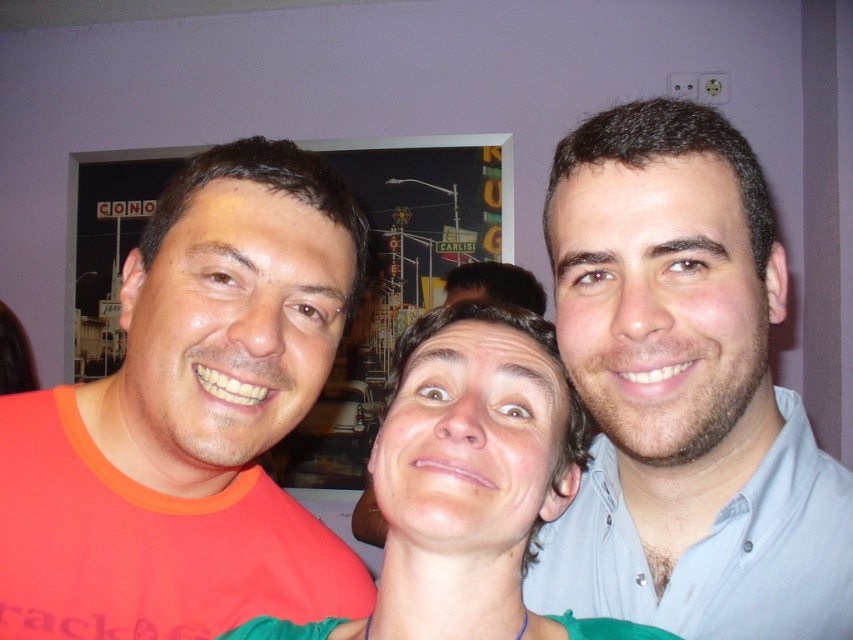
Does orange cotton t-shirt at left appear under light blue shirt at right?

Correct, orange cotton t-shirt at left is located below light blue shirt at right.

Is point (225, 237) less distant than point (527, 602)?

Yes, it is in front of point (527, 602).

Locate an element on the screen. orange cotton t-shirt at left is located at coordinates (190, 419).

Which is more to the left, orange cotton t-shirt at left or smooth skin face at center?

orange cotton t-shirt at left

Looking at this image, which of these two, orange cotton t-shirt at left or smooth skin face at center, stands taller?

orange cotton t-shirt at left is taller.

Locate an element on the screen. The width and height of the screenshot is (853, 640). orange cotton t-shirt at left is located at coordinates (190, 419).

Is point (686, 230) behind point (515, 570)?

No, it is not.

The image size is (853, 640). Find the location of `light blue shirt at right`. light blue shirt at right is located at coordinates (683, 392).

Locate an element on the screen. The image size is (853, 640). light blue shirt at right is located at coordinates click(683, 392).